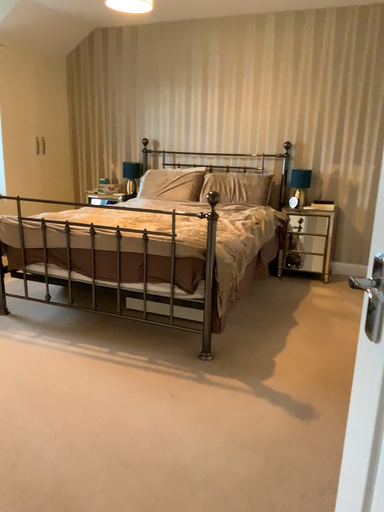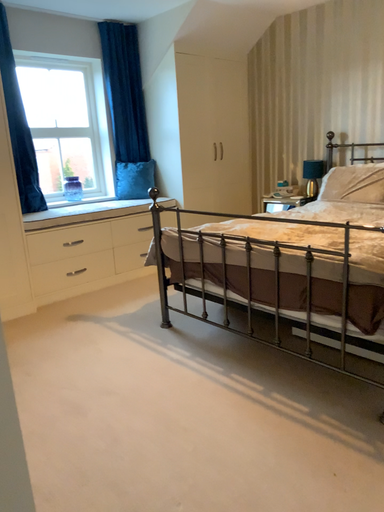
Question: How did the camera likely rotate when shooting the video?

Choices:
 (A) rotated left
 (B) rotated right

Answer: (A)